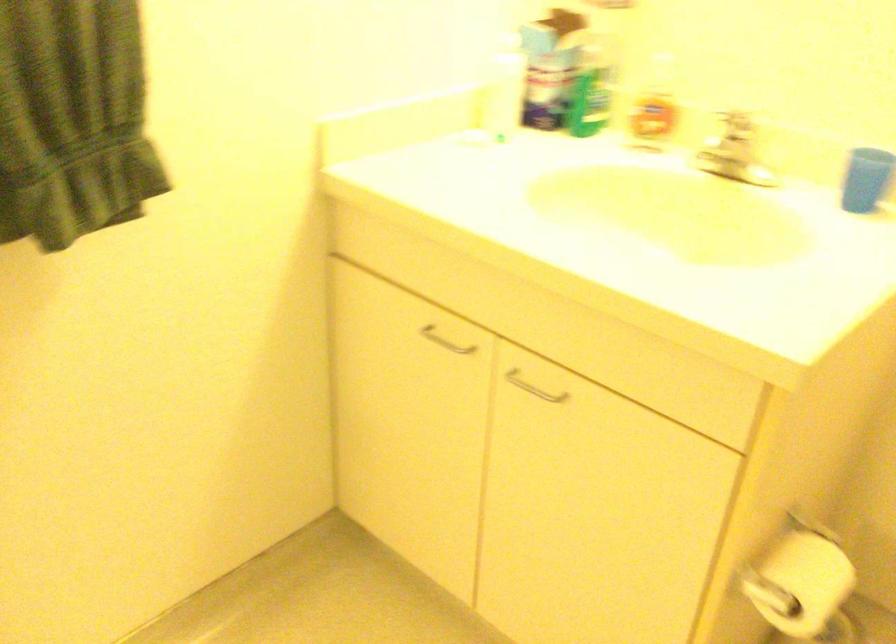
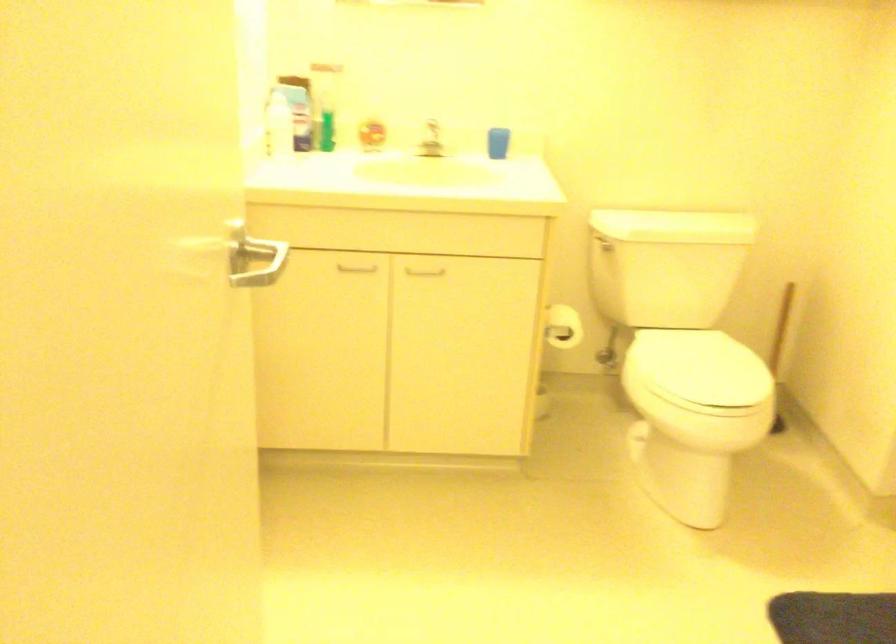
Where in the second image is the point corresponding to (x=460, y=346) from the first image?

(356, 269)